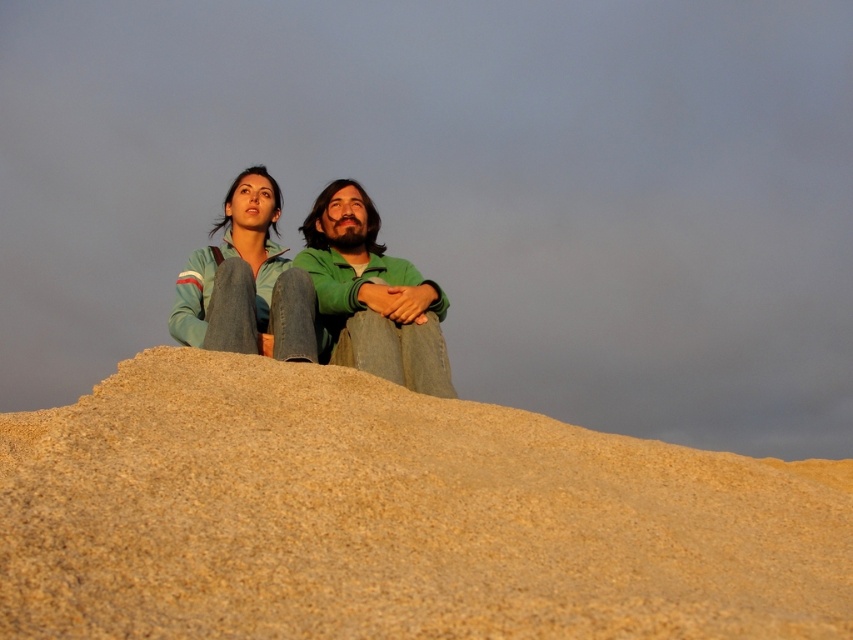
Which is in front, point (151, 516) or point (202, 332)?

Positioned in front is point (151, 516).

Can you confirm if fine sand mound at center is positioned below denim jacket at upper center?

Correct, fine sand mound at center is located below denim jacket at upper center.

This screenshot has height=640, width=853. I want to click on fine sand mound at center, so click(x=393, y=516).

Consider the image. Who is more distant from viewer, (416, 333) or (262, 248)?

Point (262, 248)

Image resolution: width=853 pixels, height=640 pixels. I want to click on green matte jacket at center, so click(372, 296).

Describe the element at coordinates (393, 516) in the screenshot. The width and height of the screenshot is (853, 640). I see `fine sand mound at center` at that location.

Can you confirm if fine sand mound at center is positioned below green matte jacket at center?

Yes.

Which is in front, point (398, 442) or point (341, 180)?

Point (398, 442) is more forward.

Where is `fine sand mound at center`? This screenshot has height=640, width=853. fine sand mound at center is located at coordinates (393, 516).